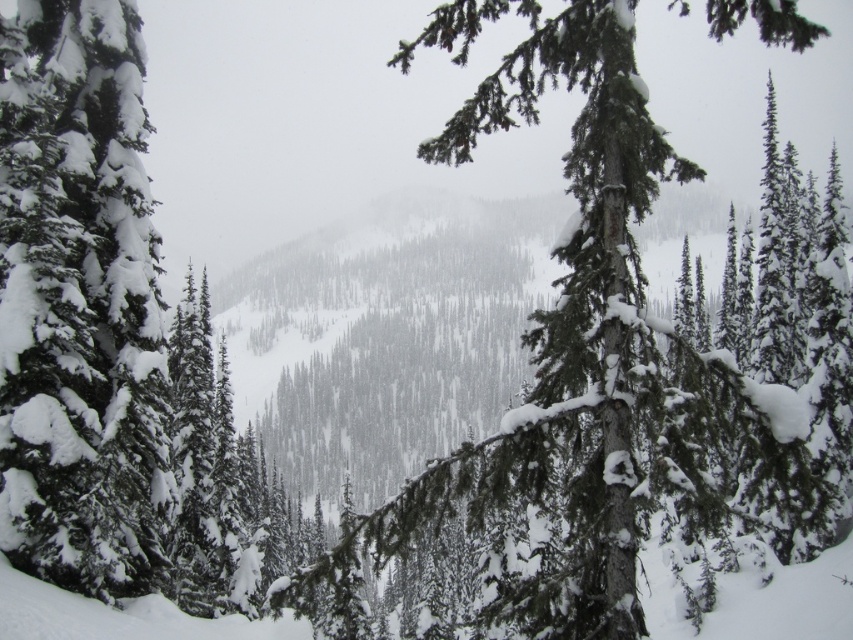
You are standing in the winter landscape and want to walk from your current position to the point marked as point (15, 250). There is an obstacle at point (547, 460). Will you encounter the obstacle before reaching your destination?

Yes, you will encounter the obstacle at point (547, 460) before reaching point (15, 250) because point (547, 460) is in front of point (15, 250).

You are standing in the winter landscape and want to take a photo of the green textured pine tree at center. Based on its position, which direction should you face to ensure it is centered in your camera view?

The green textured pine tree at center is located at point coordinates, so you should face directly towards the center of the scene to capture it in your photo.

You are an artist trying to paint the winter scene. You have two trees in your viewfinder, the green textured pine tree at center and the green matte tree at left. Which tree should you paint larger to accurately represent their sizes as seen in the image?

The green textured pine tree at center should be painted larger than the green matte tree at left because it is bigger in the image.